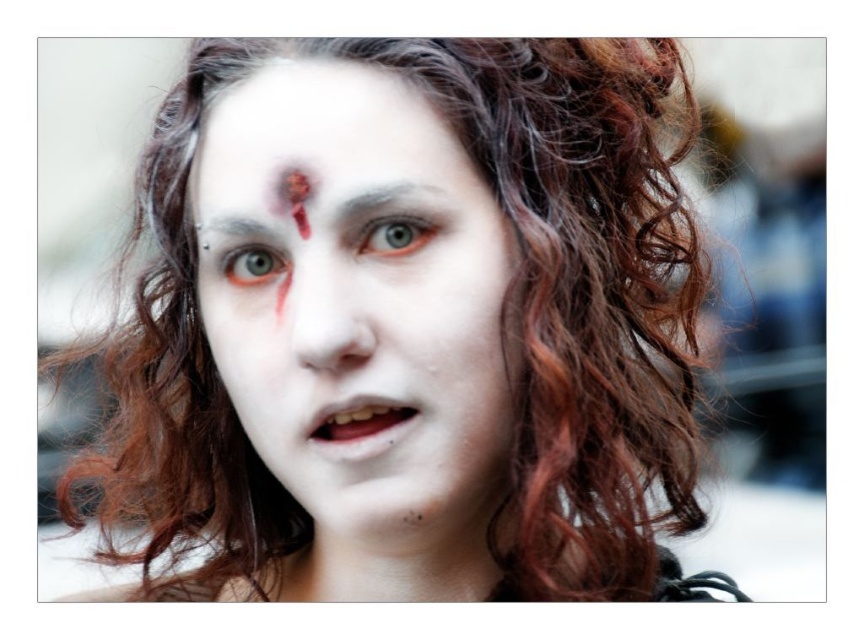
Question: Is white matte face paint at center to the right of white matte face at center from the viewer's perspective?

Choices:
 (A) no
 (B) yes

Answer: (A)

Question: Which object appears closest to the camera in this image?

Choices:
 (A) matte black eyebrow at upper center
 (B) white matte face paint at center
 (C) matte green eye at center

Answer: (B)

Question: Is white matte forehead at center bigger than dark brown eyebrow at upper center?

Choices:
 (A) yes
 (B) no

Answer: (A)

Question: Among these objects, which one is nearest to the camera?

Choices:
 (A) white matte forehead at center
 (B) white matte face at center
 (C) matte green eye at upper left

Answer: (B)

Question: Can you confirm if white matte face at center is positioned above white matte forehead at center?

Choices:
 (A) yes
 (B) no

Answer: (B)

Question: Which of the following is the farthest from the observer?

Choices:
 (A) dark brown eyebrow at upper center
 (B) matte black eyebrow at upper center
 (C) white matte face paint at center
 (D) matte green eye at center

Answer: (B)